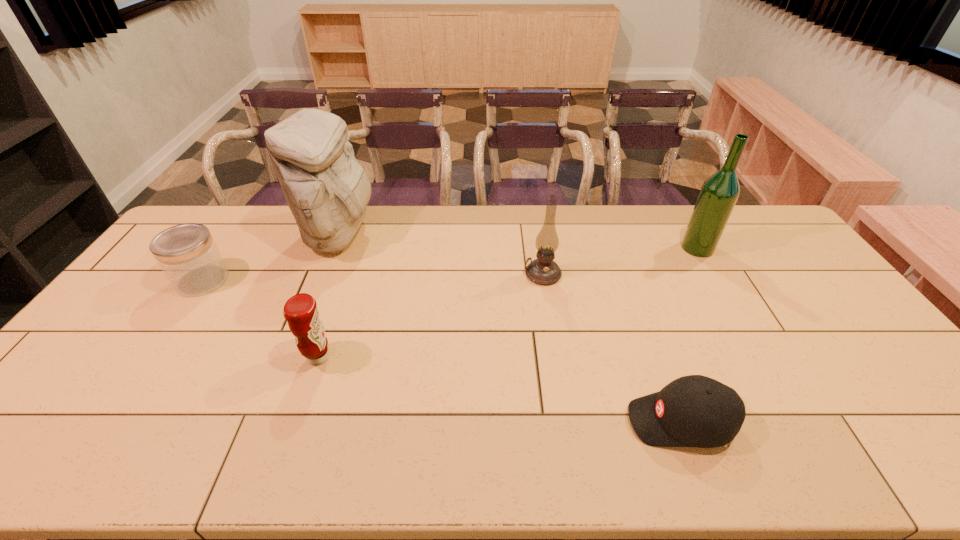
Where is `backpack`? The image size is (960, 540). backpack is located at coordinates (327, 190).

Find the location of `alcohol`. alcohol is located at coordinates (719, 193).

The height and width of the screenshot is (540, 960). What are the coordinates of `the third object from right to left` in the screenshot? It's located at (544, 271).

This screenshot has height=540, width=960. What are the coordinates of `the third tallest object` in the screenshot? It's located at (544, 271).

Locate an element on the screen. The width and height of the screenshot is (960, 540). condiment is located at coordinates click(x=301, y=312).

The image size is (960, 540). I want to click on the second nearest object, so click(x=301, y=312).

This screenshot has width=960, height=540. I want to click on the fifth tallest object, so click(187, 254).

You are a GUI agent. You are given a task and a screenshot of the screen. Output one action in this format:
    pyautogui.click(x=<x>, y=<y>)
    Task: Click on the leftmost object
    The height and width of the screenshot is (540, 960).
    Given the screenshot: What is the action you would take?
    pyautogui.click(x=187, y=254)

The image size is (960, 540). In order to click on baseball cap in this screenshot , I will do `click(697, 411)`.

The width and height of the screenshot is (960, 540). What are the coordinates of `the nearest object` in the screenshot? It's located at (697, 411).